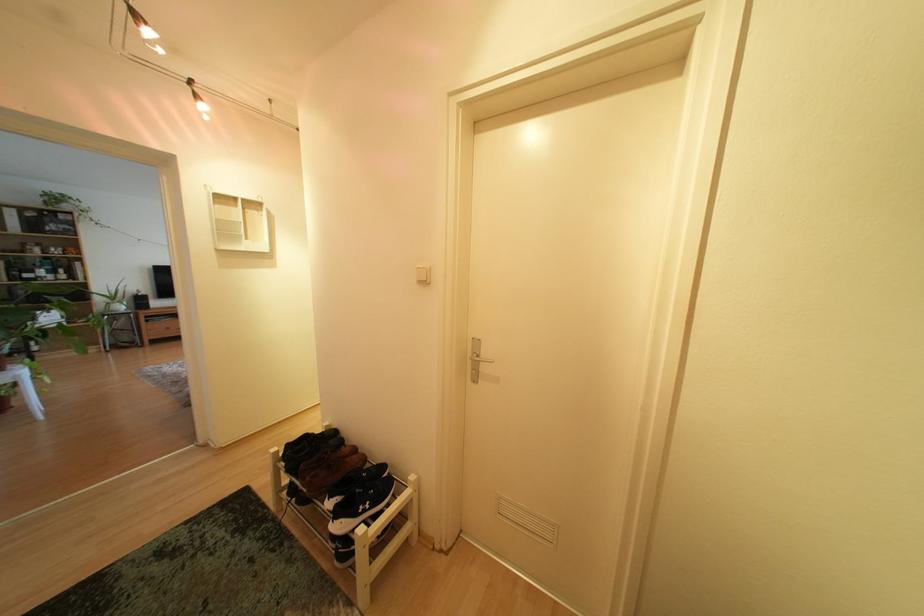
Identify the location of cabinet drawer handle. (156, 320).